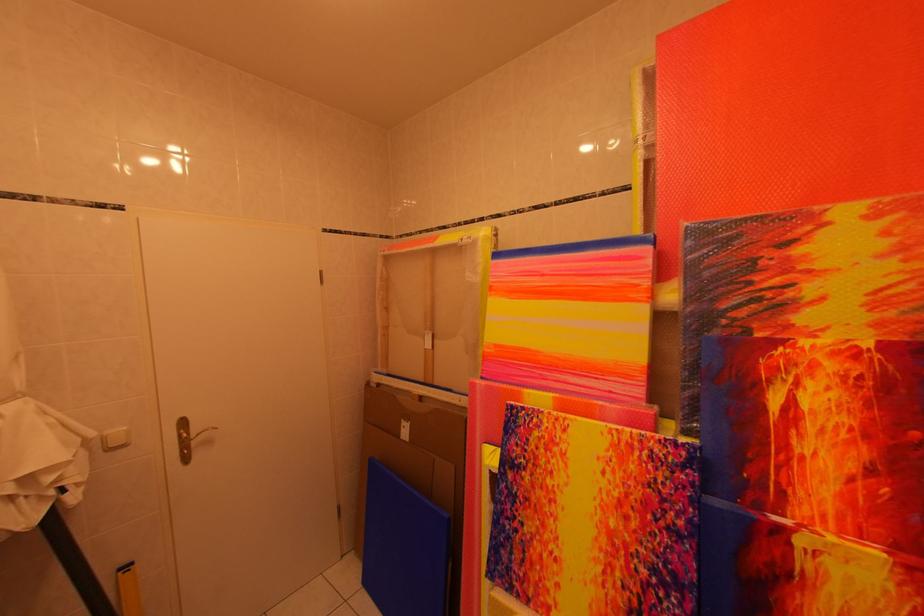
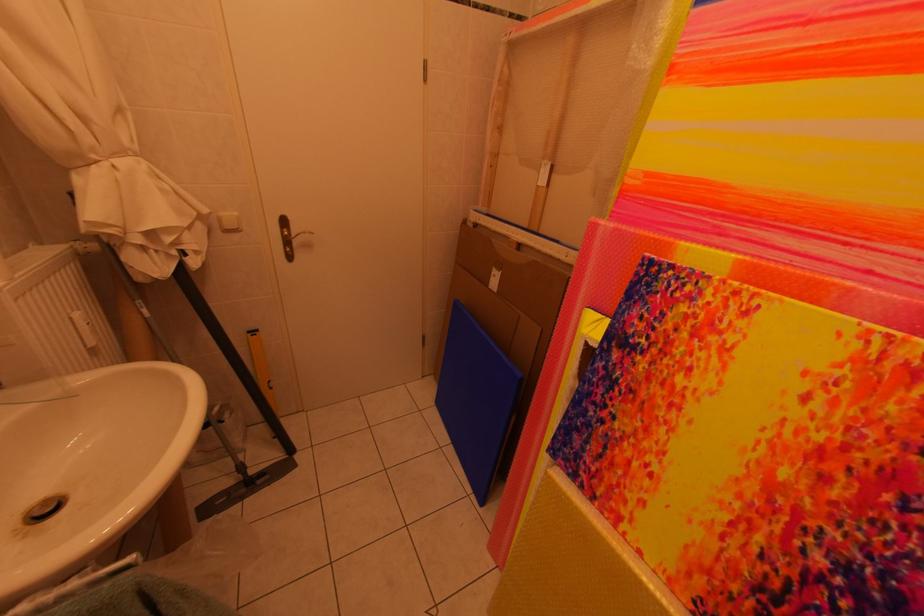
In the second image, find the point that corresponds to point (185, 426) in the first image.

(286, 223)